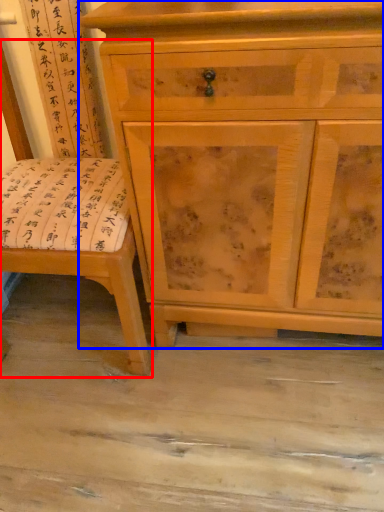
Question: Which of the following is the farthest to the observer, swivel chair (highlighted by a red box) or chest of drawers (highlighted by a blue box)?

Choices:
 (A) swivel chair
 (B) chest of drawers

Answer: (B)